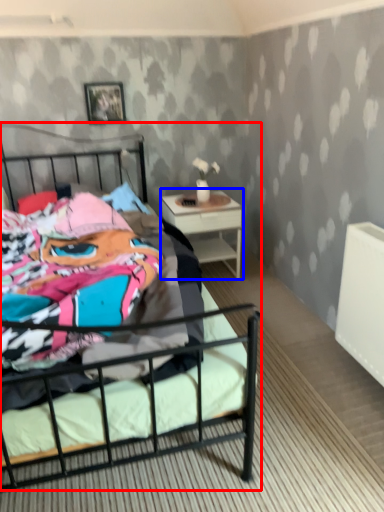
Question: Which object is further to the camera taking this photo, bed (highlighted by a red box) or nightstand (highlighted by a blue box)?

Choices:
 (A) bed
 (B) nightstand

Answer: (B)